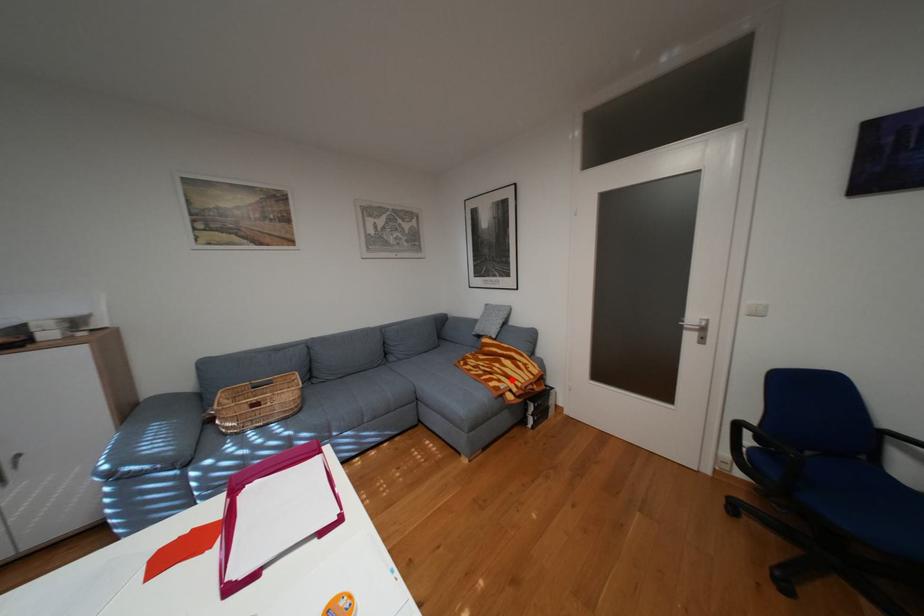
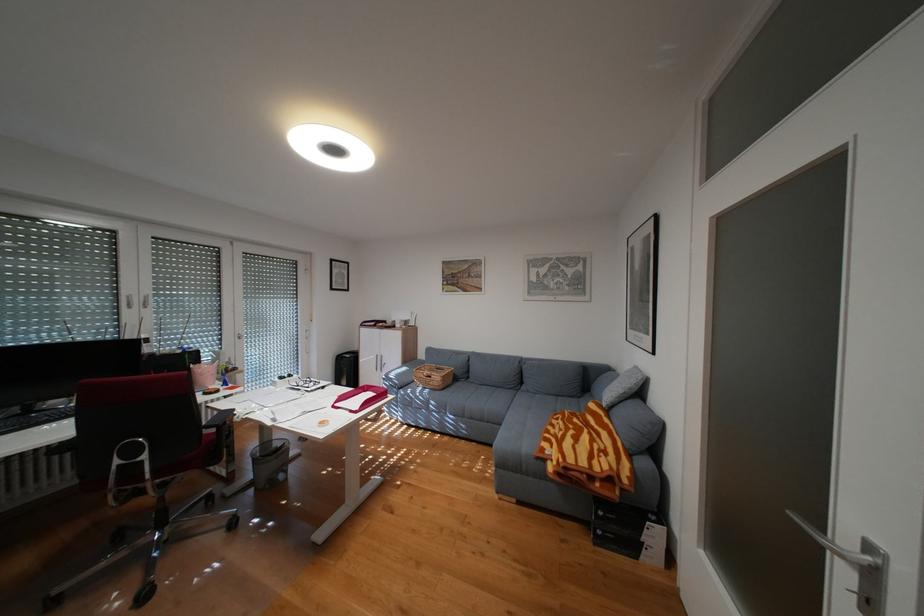
Find the pixel in the second image that matches the highlighted location in the first image.

(564, 445)